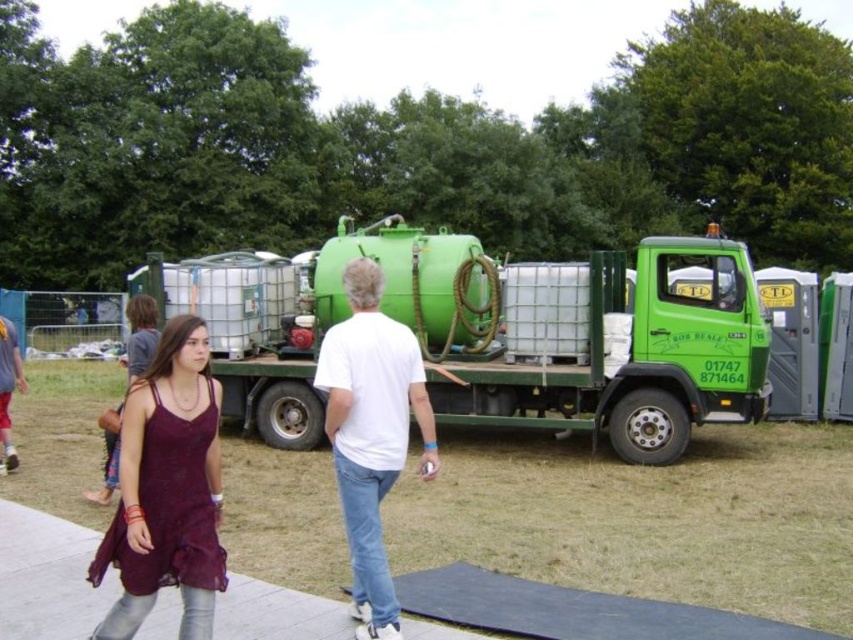
Question: Among these points, which one is nearest to the camera?

Choices:
 (A) (654, 300)
 (B) (345, 324)

Answer: (B)

Question: Does burgundy lace dress at center lie behind white matte shirt at center?

Choices:
 (A) yes
 (B) no

Answer: (B)

Question: Among these points, which one is nearest to the camera?

Choices:
 (A) (444, 264)
 (B) (140, 456)
 (C) (177, 609)
 (D) (354, 544)

Answer: (B)

Question: Can you confirm if green matte truck at center is positioned above burgundy lace dress at center?

Choices:
 (A) yes
 (B) no

Answer: (A)

Question: Which point is farther to the camera?

Choices:
 (A) (256, 326)
 (B) (154, 429)
 (C) (433, 456)
 (D) (10, 566)

Answer: (A)

Question: Is the position of burgundy lace dress at center less distant than that of white concrete pavement at lower center?

Choices:
 (A) no
 (B) yes

Answer: (B)